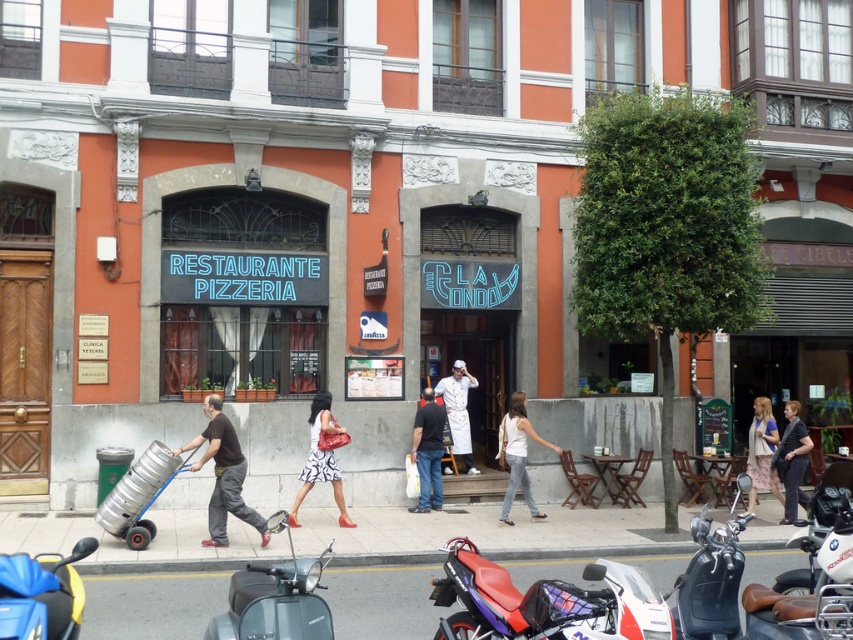
Who is more forward, (433, 554) or (209, 545)?

Point (433, 554) is in front.

Which is more to the right, gray concrete pavement at lower center or brown matte pants at lower left?

gray concrete pavement at lower center is more to the right.

Which is behind, point (387, 563) or point (218, 477)?

Positioned behind is point (218, 477).

At what (x,y) coordinates should I click in order to perform the action: click on gray concrete pavement at lower center. Please return your answer as a coordinate pair (x, y). The width and height of the screenshot is (853, 640). Looking at the image, I should click on (492, 532).

Can you confirm if white printed dress at center is wider than white chef's uniform at center?

Yes.

Which is above, white printed dress at center or white chef's uniform at center?

Positioned higher is white chef's uniform at center.

Locate an element on the screen. The height and width of the screenshot is (640, 853). white printed dress at center is located at coordinates (321, 460).

Which of these two, metallic silver scooter at lower center or dark blue jeans at center, stands shorter?

Standing shorter between the two is metallic silver scooter at lower center.

Looking at this image, can you confirm if metallic silver scooter at lower center is thinner than dark blue jeans at center?

No, metallic silver scooter at lower center is not thinner than dark blue jeans at center.

Find the location of a particular element. Image resolution: width=853 pixels, height=640 pixels. metallic silver scooter at lower center is located at coordinates (276, 596).

Find the location of a particular element. This screenshot has width=853, height=640. metallic silver scooter at lower center is located at coordinates (276, 596).